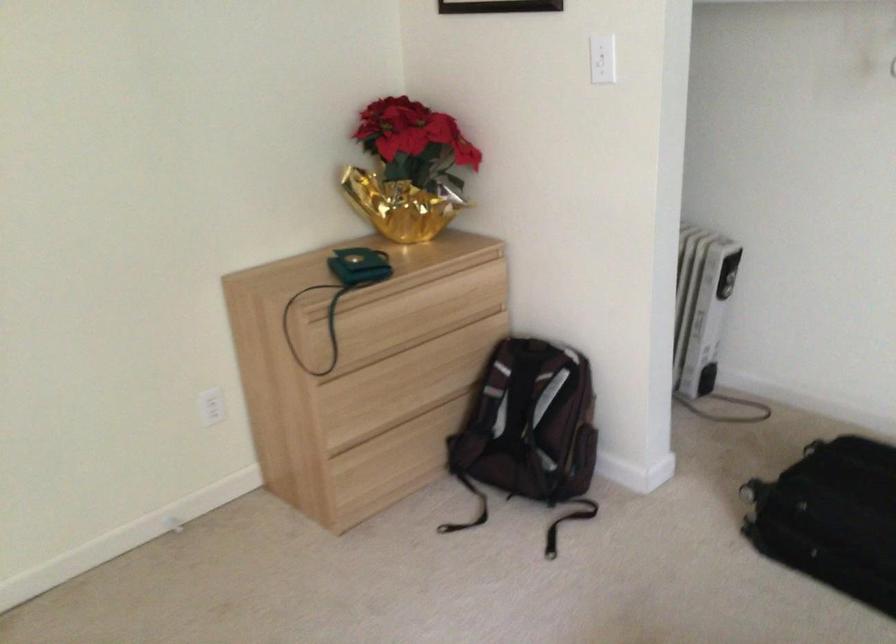
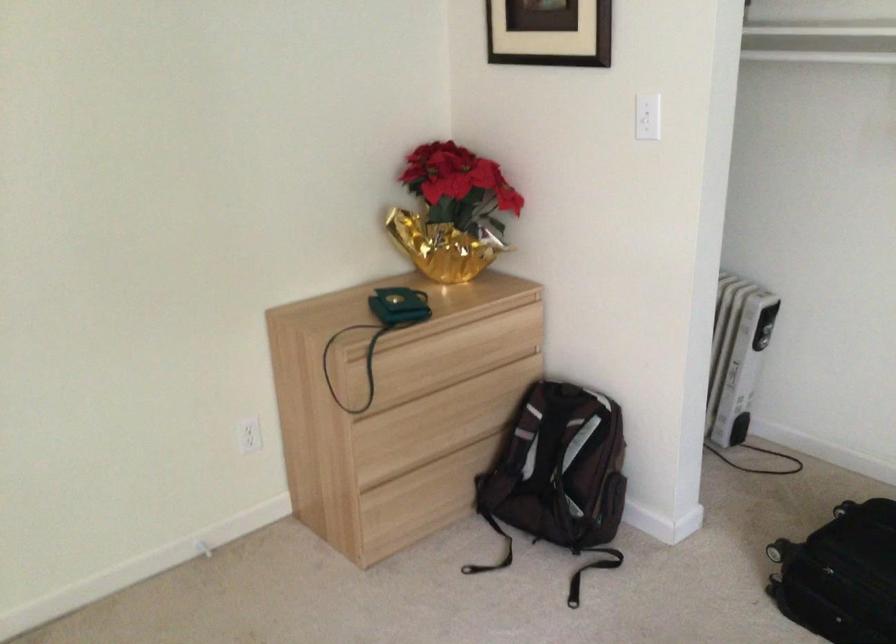
Find the pixel in the second image that matches [401,386] in the first image.

(434, 424)